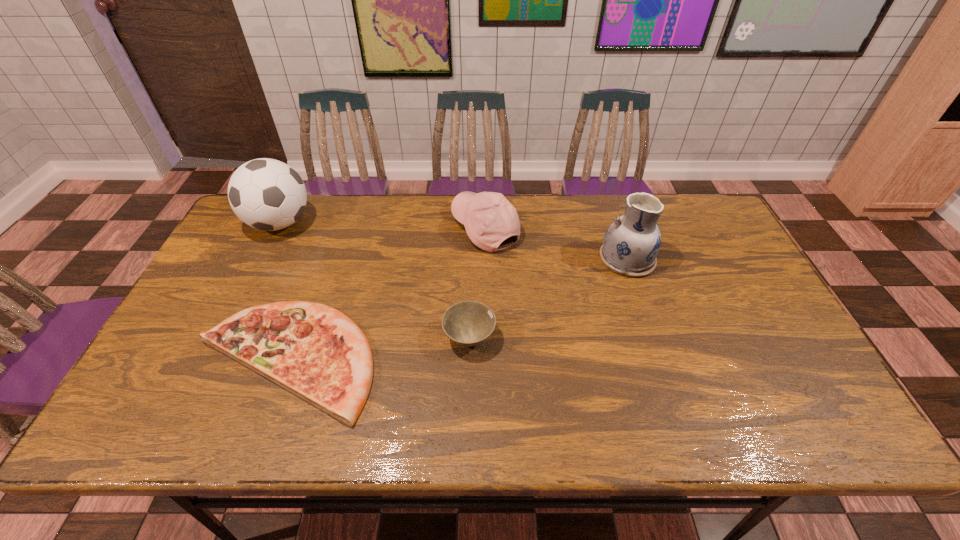
At what (x,y) coordinates should I click in order to perform the action: click on vacant area that lies between the soccer ball and the shortest object. Please return your answer as a coordinate pair (x, y). Looking at the image, I should click on (282, 291).

Image resolution: width=960 pixels, height=540 pixels. What are the coordinates of `free area in between the rightmost object and the soccer ball` in the screenshot? It's located at (453, 241).

Find the location of `the closest object relative to the bowl`. the closest object relative to the bowl is located at coordinates (316, 352).

The image size is (960, 540). In order to click on object that ranks as the fourth closest to the baseball cap in this screenshot , I will do `click(266, 194)`.

Image resolution: width=960 pixels, height=540 pixels. Identify the location of free region that satisfies the following two spatial constraints: 1. on the front-facing side of the pottery; 2. on the left side of the third tallest object. (486, 259).

Find the location of `vacant area in the image that satisfies the following two spatial constraints: 1. on the front side of the rightmost object; 2. on the left side of the soccer ball`. vacant area in the image that satisfies the following two spatial constraints: 1. on the front side of the rightmost object; 2. on the left side of the soccer ball is located at coordinates (262, 259).

The image size is (960, 540). I want to click on free space that satisfies the following two spatial constraints: 1. on the front side of the rightmost object; 2. on the left side of the soccer ball, so coord(262,259).

This screenshot has height=540, width=960. I want to click on vacant point that satisfies the following two spatial constraints: 1. on the front-facing side of the third tallest object; 2. on the front side of the shortest object, so click(x=487, y=359).